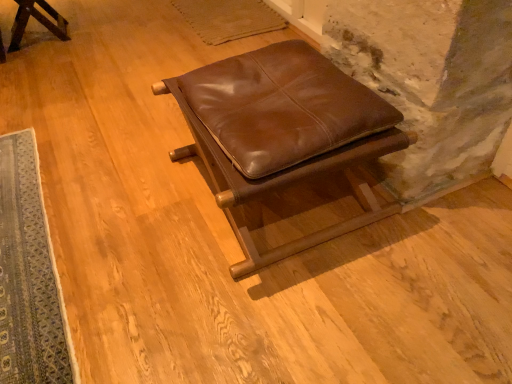
Find the location of `free area in between matte brown leather stool at upper left, the 1th furniture in the back-to-front sequence, and brown leather ottoman at center, which ranks as the first furniture in bottom-to-top order`. free area in between matte brown leather stool at upper left, the 1th furniture in the back-to-front sequence, and brown leather ottoman at center, which ranks as the first furniture in bottom-to-top order is located at coordinates (109, 97).